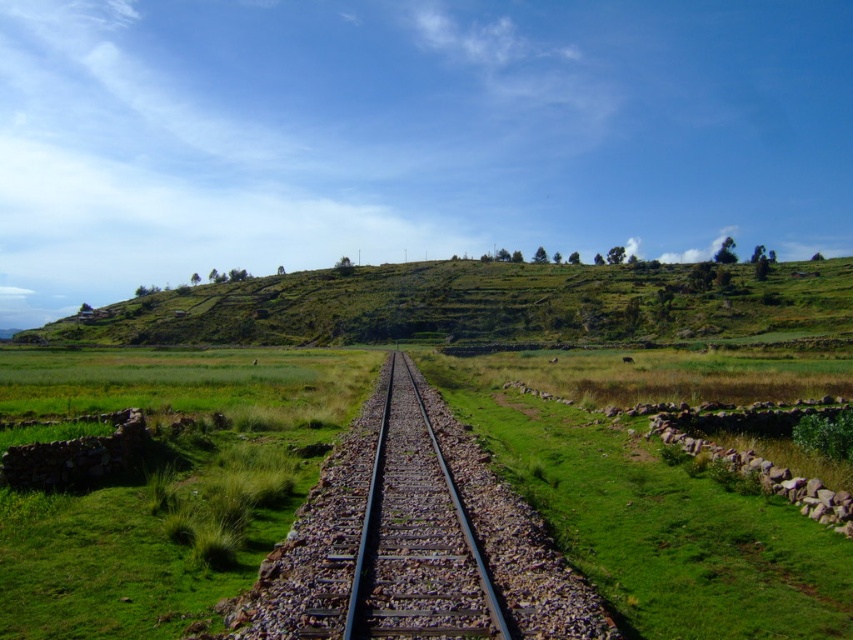
Which is above, green grassy hillside at center or metal/smooth train track at center?

green grassy hillside at center

Does green grassy hillside at center appear on the left side of metal/smooth train track at center?

Yes, green grassy hillside at center is to the left of metal/smooth train track at center.

Find the location of a particular element. green grassy hillside at center is located at coordinates point(474,305).